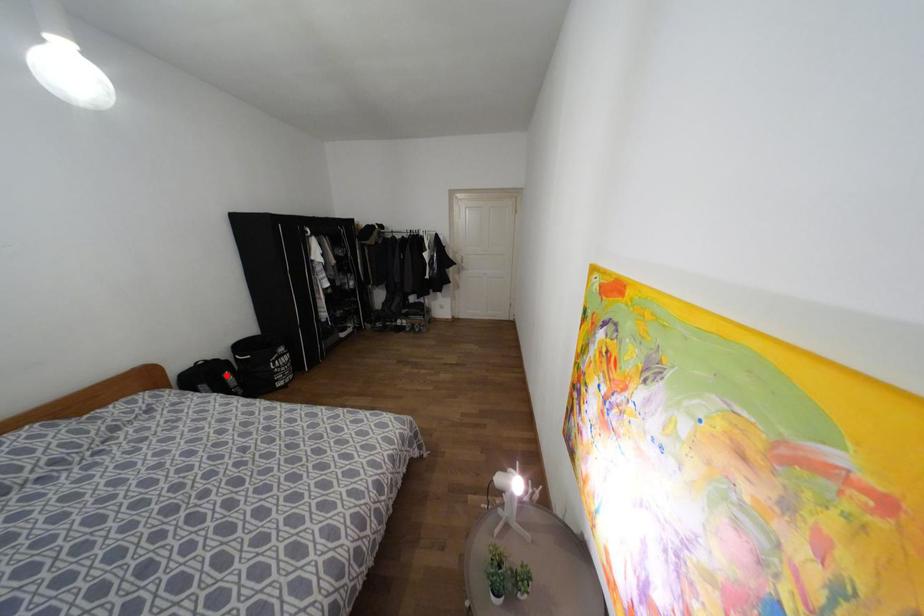
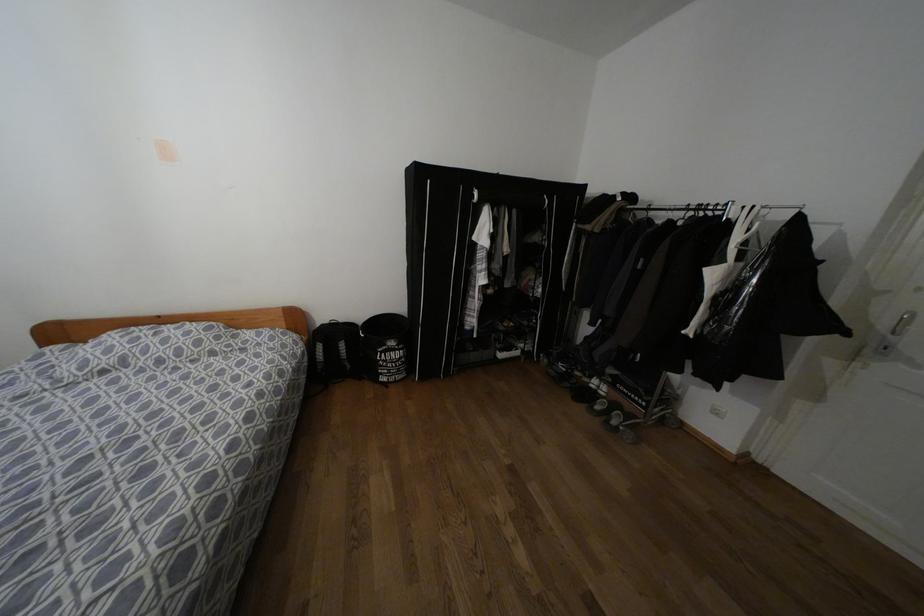
In the second image, find the point that corresponds to the highlighted location in the first image.

(342, 345)